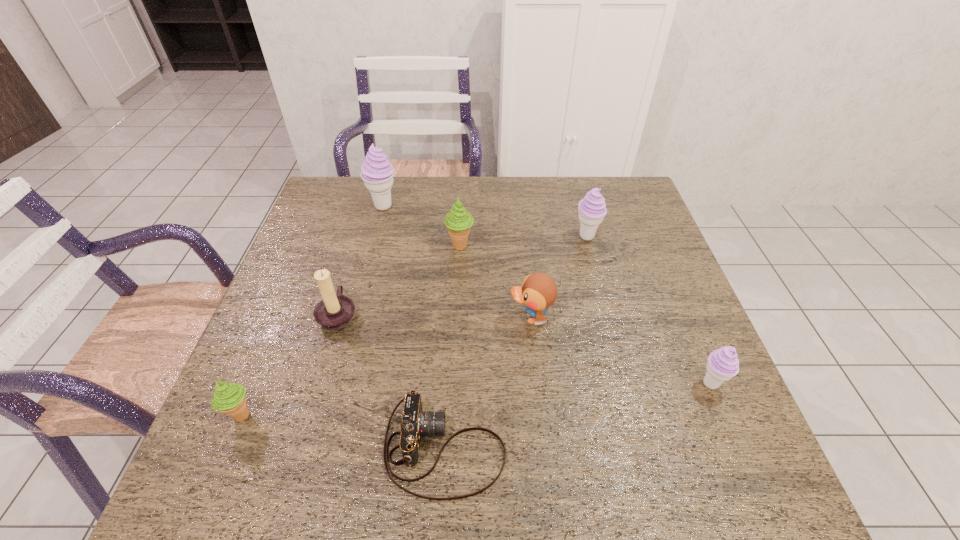
Find the location of a particular element. free space located 0.100m on the front-facing side of the third object from right to left is located at coordinates tap(468, 318).

Find the location of `blank space located 0.170m on the front-facing side of the third object from right to left`. blank space located 0.170m on the front-facing side of the third object from right to left is located at coordinates (439, 318).

Locate an element on the screen. This screenshot has width=960, height=540. vacant space positioned 0.340m on the right of the leftmost object is located at coordinates (425, 414).

Identify the location of vacant space located 0.160m on the back of the rightmost purple icecream. This screenshot has height=540, width=960. (682, 315).

Where is `vacant point located 0.270m on the front-facing side of the brown camera`? The width and height of the screenshot is (960, 540). vacant point located 0.270m on the front-facing side of the brown camera is located at coordinates (647, 448).

Locate an element on the screen. The width and height of the screenshot is (960, 540). object positioned at the far edge is located at coordinates (377, 173).

The height and width of the screenshot is (540, 960). I want to click on object located in the near edge section of the desktop, so click(415, 424).

Image resolution: width=960 pixels, height=540 pixels. Identify the location of candle holder present at the left edge. (335, 311).

You are a GUI agent. You are given a task and a screenshot of the screen. Output one action in this format:
    pyautogui.click(x=<x>, y=<y>)
    Task: Click on the icecream present at the left edge
    
    Given the screenshot: What is the action you would take?
    pyautogui.click(x=229, y=398)

Where is `object at the right edge`? The width and height of the screenshot is (960, 540). object at the right edge is located at coordinates (723, 364).